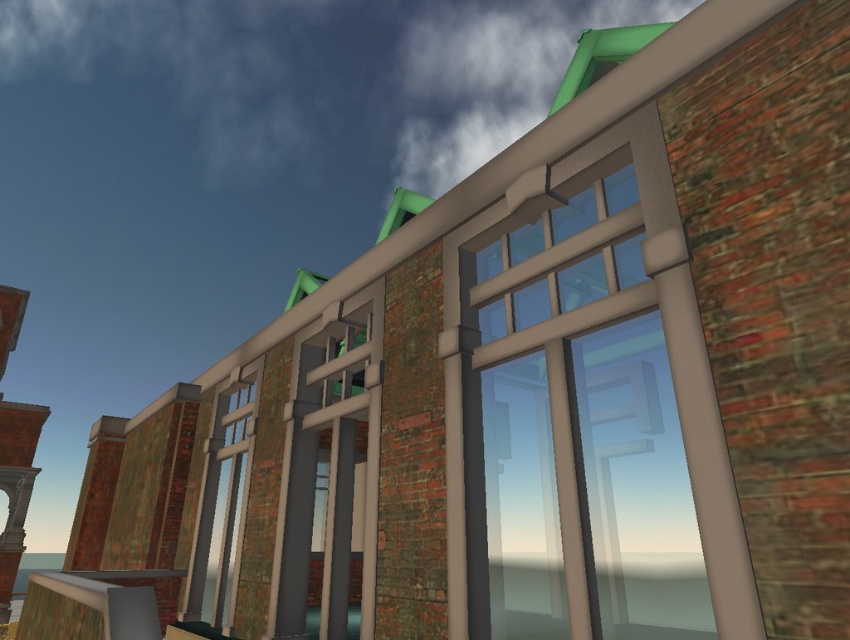
In the scene shown: Is clear glass window at upper center bigger than brick tower at left?

No.

Is clear glass window at upper center shorter than brick tower at left?

Indeed, clear glass window at upper center has a lesser height compared to brick tower at left.

Who is more distant from viewer, [673,481] or [4,465]?

The point [673,481] is behind.

What are the coordinates of `clear glass window at upper center` in the screenshot? It's located at (582, 426).

Is clear glass window at center shorter than brick tower at left?

Yes, clear glass window at center is shorter than brick tower at left.

Does clear glass window at center have a smaller size compared to brick tower at left?

Indeed, clear glass window at center has a smaller size compared to brick tower at left.

Between point (187, 572) and point (26, 435), which one is positioned in front?

Point (187, 572) is more forward.

Image resolution: width=850 pixels, height=640 pixels. Find the location of `clear glass window at center`. clear glass window at center is located at coordinates (221, 504).

Between clear glass window at upper center and clear glass window at center, which one has more height?

clear glass window at upper center is taller.

Based on the photo, does clear glass window at upper center come in front of clear glass window at center?

Yes, clear glass window at upper center is closer to the viewer.

Does point (602, 344) come farther from viewer compared to point (252, 442)?

Yes, point (602, 344) is farther from viewer.

Where is `clear glass window at upper center`? The height and width of the screenshot is (640, 850). clear glass window at upper center is located at coordinates (582, 426).